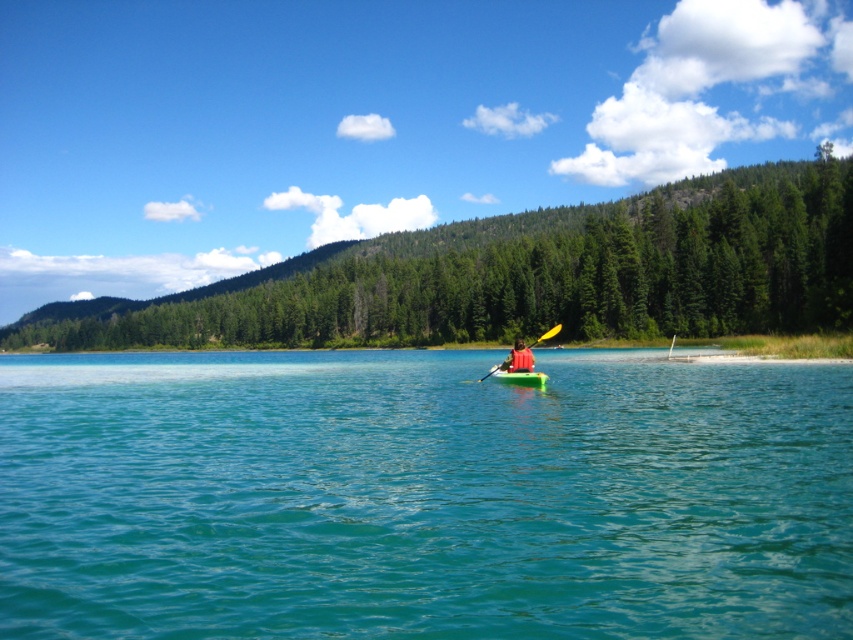
Is clear blue water at center taller than green plastic canoe at center?

Indeed, clear blue water at center has a greater height compared to green plastic canoe at center.

Does clear blue water at center appear on the left side of green plastic canoe at center?

Correct, you'll find clear blue water at center to the left of green plastic canoe at center.

Identify the location of clear blue water at center. click(x=422, y=497).

Does green plastic kayak at center appear on the right side of yellow plastic paddle at center?

No, green plastic kayak at center is not to the right of yellow plastic paddle at center.

Is green plastic kayak at center thinner than yellow plastic paddle at center?

Correct, green plastic kayak at center's width is less than yellow plastic paddle at center's.

Is point (503, 369) behind point (547, 330)?

No, it is not.

Locate an element on the screen. The image size is (853, 640). green plastic kayak at center is located at coordinates (518, 358).

Is green matte tree at upper center further to camera compared to green plastic kayak at center?

Yes, it is.

Measure the distance from green matte tree at upper center to green plastic kayak at center.

They are 119.35 meters apart.

Who is more forward, (554, 218) or (527, 353)?

Point (527, 353) is more forward.

Image resolution: width=853 pixels, height=640 pixels. Identify the location of green matte tree at upper center. 527,275.